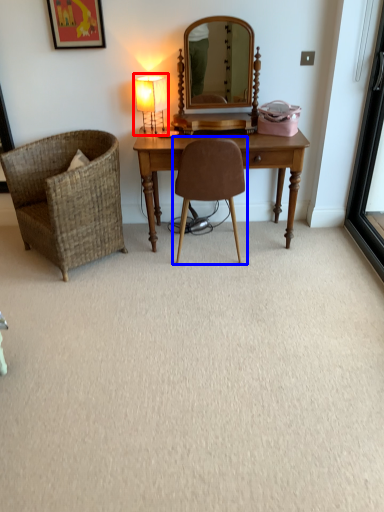
Question: Among these objects, which one is nearest to the camera, table lamp (highlighted by a red box) or chair (highlighted by a blue box)?

Choices:
 (A) table lamp
 (B) chair

Answer: (B)